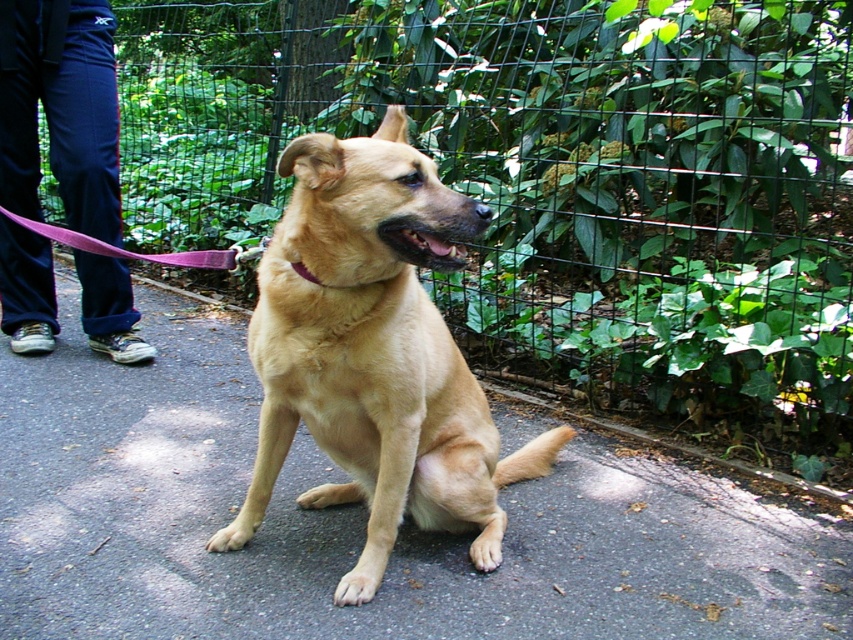
Question: Is golden fur dog at center smaller than pink fabric leash at center?

Choices:
 (A) no
 (B) yes

Answer: (A)

Question: Among these points, which one is nearest to the camera?

Choices:
 (A) (15, 284)
 (B) (320, 298)
 (C) (328, 285)
 (D) (36, 458)

Answer: (C)

Question: Which object is positioned farthest from the blue fabric pants at left?

Choices:
 (A) golden fur dog at center
 (B) smooth asphalt pavement at center
 (C) pink fabric leash at center
 (D) purple fabric neckband at center

Answer: (D)

Question: Can you confirm if smooth asphalt pavement at center is positioned below blue fabric pants at left?

Choices:
 (A) no
 (B) yes

Answer: (B)

Question: Among these points, which one is farthest from the camera?

Choices:
 (A) (18, 310)
 (B) (39, 228)

Answer: (A)

Question: Can you confirm if smooth asphalt pavement at center is wider than pink fabric leash at center?

Choices:
 (A) no
 (B) yes

Answer: (B)